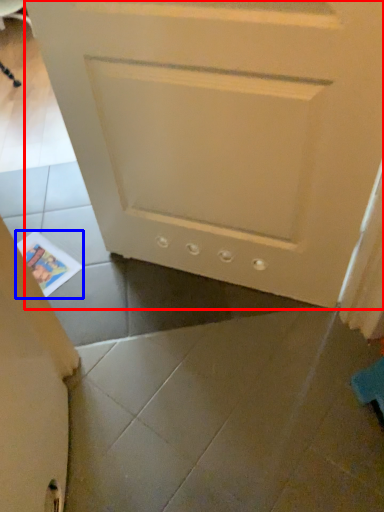
Question: Which object appears farthest to the camera in this image, door (highlighted by a red box) or magazine (highlighted by a blue box)?

Choices:
 (A) door
 (B) magazine

Answer: (B)